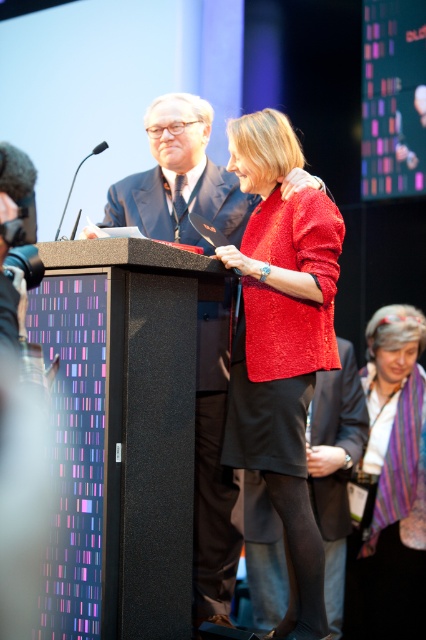
Can you confirm if shiny red jacket at center is positioned above matte black suit at center?

Actually, shiny red jacket at center is below matte black suit at center.

Can you confirm if shiny red jacket at center is positioned to the left of matte black suit at center?

Incorrect, shiny red jacket at center is not on the left side of matte black suit at center.

The width and height of the screenshot is (426, 640). Identify the location of shiny red jacket at center. (282, 346).

Where is `shiny red jacket at center`? shiny red jacket at center is located at coordinates (282, 346).

Does matte black suit at center have a smaller size compared to multicolored woven scarf at lower right?

No.

Is matte black suit at center to the left of multicolored woven scarf at lower right from the viewer's perspective?

Indeed, matte black suit at center is positioned on the left side of multicolored woven scarf at lower right.

Locate an element on the screen. The height and width of the screenshot is (640, 426). matte black suit at center is located at coordinates [x=178, y=179].

Who is more distant from viewer, (285, 141) or (396, 625)?

The point (396, 625) is behind.

What do you see at coordinates (282, 346) in the screenshot?
I see `shiny red jacket at center` at bounding box center [282, 346].

What are the coordinates of `shiny red jacket at center` in the screenshot? It's located at (282, 346).